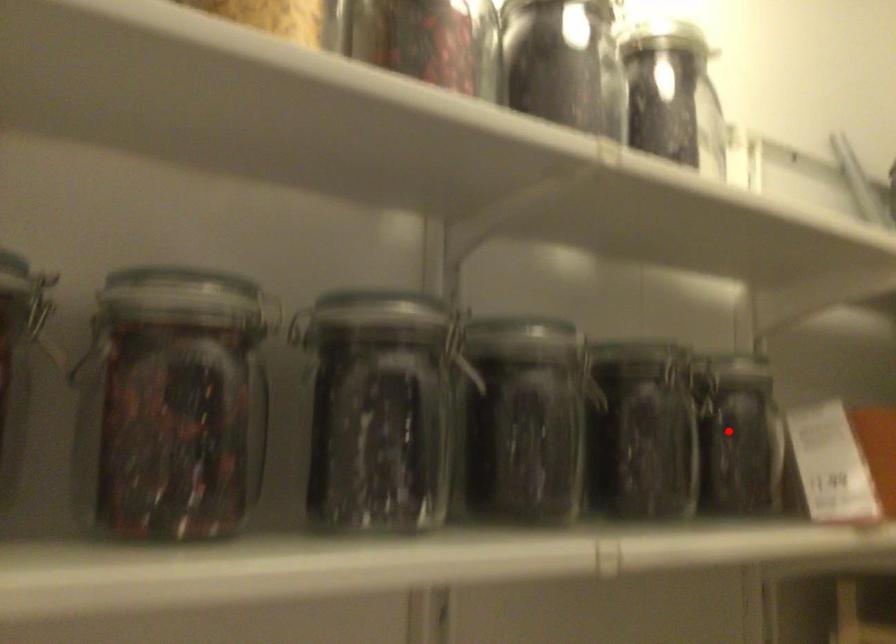
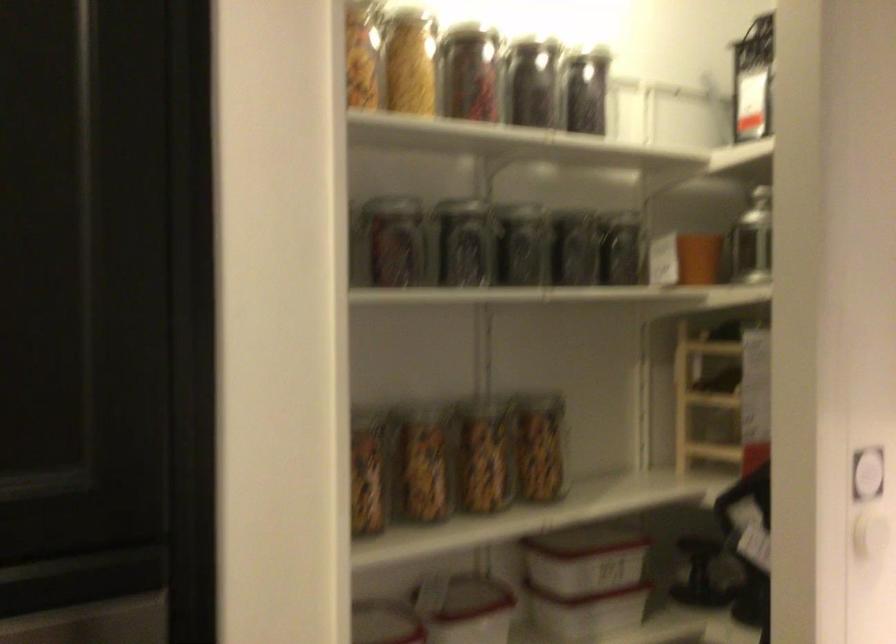
Find the pixel in the second image that matches the highlighted location in the first image.

(622, 249)